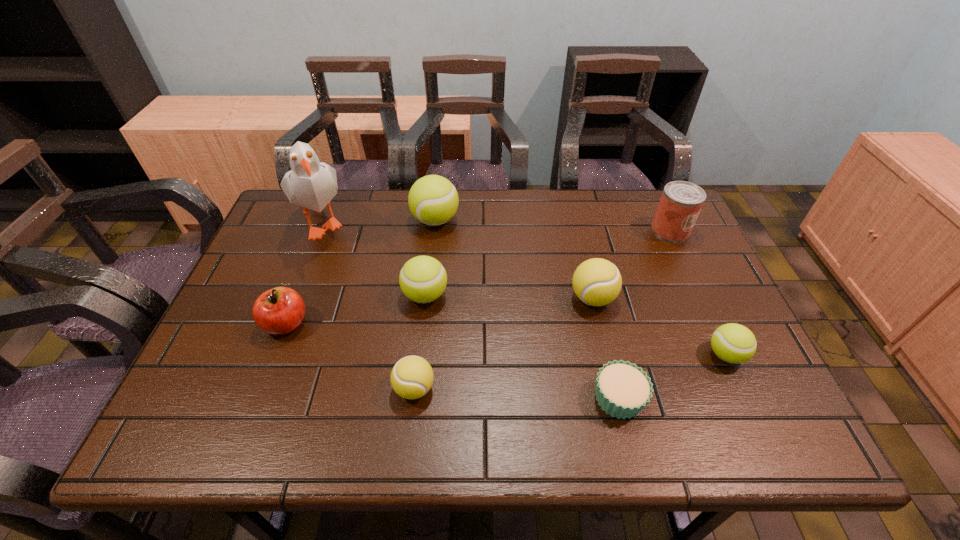
Locate which green tennis ball ranks in proximity to the apple. Please provide its 2D coordinates. Your answer should be formatted as a tuple, i.e. [(x, y)], where the tuple contains the x and y coordinates of a point satisfying the conditions above.

[(423, 279)]

Where is `free location that satisfies the following two spatial constraints: 1. at the beak of the smaller yellow tennis ball; 2. on the left side of the tallest object`? This screenshot has width=960, height=540. free location that satisfies the following two spatial constraints: 1. at the beak of the smaller yellow tennis ball; 2. on the left side of the tallest object is located at coordinates (260, 388).

Locate an element on the screen. This screenshot has width=960, height=540. free location that satisfies the following two spatial constraints: 1. at the beak of the tallest object; 2. on the left side of the second biggest green tennis ball is located at coordinates [x=296, y=295].

In order to click on vacant area in the image that satisfies the following two spatial constraints: 1. on the front side of the rightmost tennis ball; 2. on the left side of the farther yellow tennis ball in this screenshot , I will do click(x=606, y=355).

This screenshot has height=540, width=960. Find the location of `blank space that satisfies the following two spatial constraints: 1. on the back side of the smallest green tennis ball; 2. on the right side of the cupcake`. blank space that satisfies the following two spatial constraints: 1. on the back side of the smallest green tennis ball; 2. on the right side of the cupcake is located at coordinates (609, 355).